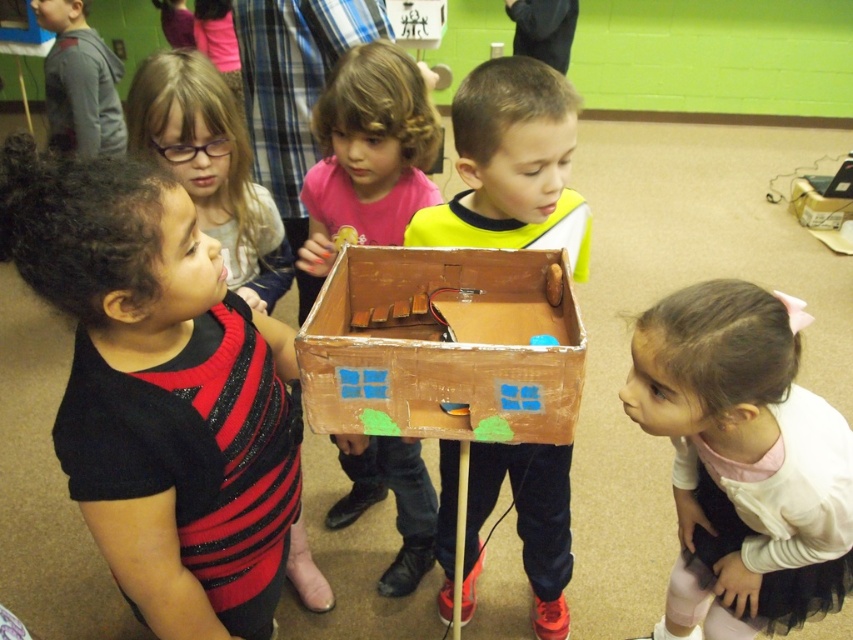
Is the position of black glitter tank top at left more distant than that of cardboard box at center?

No.

Who is more distant from viewer, (65, 234) or (467, 109)?

Positioned behind is point (467, 109).

I want to click on black glitter tank top at left, so click(160, 392).

Can you confirm if black glitter dress at left is positioned to the left of brown cardboard box at upper right?

Yes, black glitter dress at left is to the left of brown cardboard box at upper right.

Is point (254, 225) farther from camera compared to point (793, 196)?

No, it is not.

Between point (215, 166) and point (820, 196), which one is positioned behind?

Positioned behind is point (820, 196).

The width and height of the screenshot is (853, 640). In order to click on black glitter dress at left in this screenshot , I will do `click(210, 168)`.

Which is above, black glitter tank top at left or cardboard house at center?

cardboard house at center is higher up.

Is the position of black glitter tank top at left more distant than that of cardboard house at center?

No, black glitter tank top at left is in front of cardboard house at center.

This screenshot has width=853, height=640. What are the coordinates of `black glitter tank top at left` in the screenshot? It's located at (160, 392).